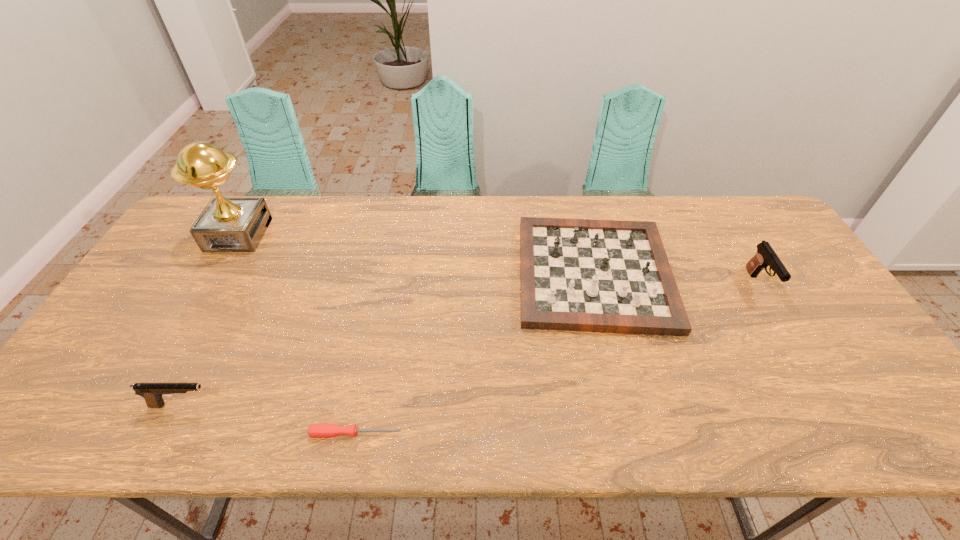
The width and height of the screenshot is (960, 540). Find the location of `vacant space located on the front of the second object from right to left`. vacant space located on the front of the second object from right to left is located at coordinates (635, 434).

The image size is (960, 540). Identify the location of free region located at the muzzle of the second nearest object. (383, 405).

This screenshot has width=960, height=540. I want to click on vacant space located at the tip of the screwdriver, so (531, 433).

The height and width of the screenshot is (540, 960). What are the coordinates of `award at the far edge` in the screenshot? It's located at (227, 224).

Locate an element on the screen. The image size is (960, 540). chessboard located in the far edge section of the desktop is located at coordinates (610, 276).

Where is `pistol that is at the near edge`? Image resolution: width=960 pixels, height=540 pixels. pistol that is at the near edge is located at coordinates (152, 392).

In order to click on screwdriver at the near edge in this screenshot , I will do `click(314, 430)`.

At what (x,y) coordinates should I click in order to perform the action: click on object that is at the left edge. Please return your answer as a coordinate pair (x, y). This screenshot has width=960, height=540. Looking at the image, I should click on (227, 224).

I want to click on object that is at the right edge, so click(x=765, y=256).

Where is `object at the far left corner`? This screenshot has height=540, width=960. object at the far left corner is located at coordinates (227, 224).